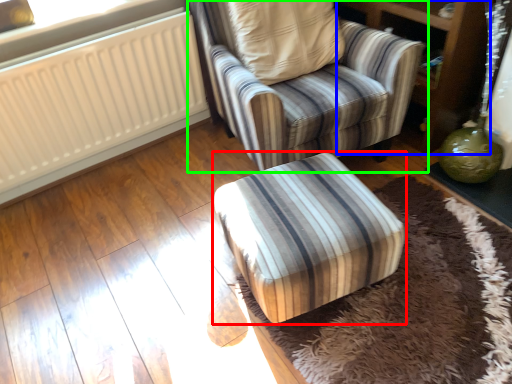
Question: Considering the real-world distances, which object is farthest from furniture (highlighted by a red box)? dresser (highlighted by a blue box) or chair (highlighted by a green box)?

Choices:
 (A) dresser
 (B) chair

Answer: (A)